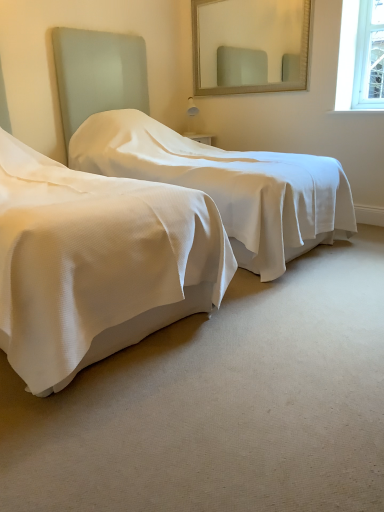
Question: Is matte glass mirror at upper center far from white textured bed at left, the first bed in the right-to-left sequence?

Choices:
 (A) no
 (B) yes

Answer: (B)

Question: Can you confirm if matte glass mirror at upper center is smaller than white textured bed at left, the first bed in the right-to-left sequence?

Choices:
 (A) yes
 (B) no

Answer: (A)

Question: Considering the relative sizes of matte glass mirror at upper center and white textured bed at left, the first bed in the right-to-left sequence, in the image provided, is matte glass mirror at upper center wider than white textured bed at left, the first bed in the right-to-left sequence,?

Choices:
 (A) yes
 (B) no

Answer: (B)

Question: From a real-world perspective, is matte glass mirror at upper center physically below white textured bed at left, the first bed in the right-to-left sequence?

Choices:
 (A) no
 (B) yes

Answer: (A)

Question: Can you confirm if matte glass mirror at upper center is bigger than white textured bed at left, which is the 2th bed in left-to-right order?

Choices:
 (A) yes
 (B) no

Answer: (B)

Question: Choose the correct answer: Is matte glass mirror at upper center inside white textured bed at center, which is the 2th bed from right to left, or outside it?

Choices:
 (A) inside
 (B) outside

Answer: (B)

Question: Relative to white textured bed at center, placed as the first bed when sorted from left to right, is matte glass mirror at upper center in front or behind?

Choices:
 (A) behind
 (B) front

Answer: (A)

Question: From the image's perspective, is matte glass mirror at upper center positioned above or below white textured bed at center, which is the 2th bed from right to left?

Choices:
 (A) above
 (B) below

Answer: (A)

Question: Looking at the image, does matte glass mirror at upper center seem bigger or smaller compared to white textured bed at center, which is the 2th bed from right to left?

Choices:
 (A) big
 (B) small

Answer: (B)

Question: From the image's perspective, relative to white textured bed at left, the first bed in the right-to-left sequence, is matte glass mirror at upper center above or below?

Choices:
 (A) above
 (B) below

Answer: (A)

Question: Is matte glass mirror at upper center taller or shorter than white textured bed at left, the first bed in the right-to-left sequence?

Choices:
 (A) tall
 (B) short

Answer: (B)

Question: Is point (291, 1) positioned closer to the camera than point (288, 162)?

Choices:
 (A) closer
 (B) farther

Answer: (B)

Question: Is matte glass mirror at upper center bigger or smaller than white textured bed at left, which is the 2th bed in left-to-right order?

Choices:
 (A) small
 (B) big

Answer: (A)

Question: Is white textured bed at left, the first bed in the right-to-left sequence, wider or thinner than white textured bed at center, placed as the first bed when sorted from left to right?

Choices:
 (A) thin
 (B) wide

Answer: (A)

Question: Is white textured bed at left, which is the 2th bed in left-to-right order, inside or outside of white textured bed at center, placed as the first bed when sorted from left to right?

Choices:
 (A) outside
 (B) inside

Answer: (A)